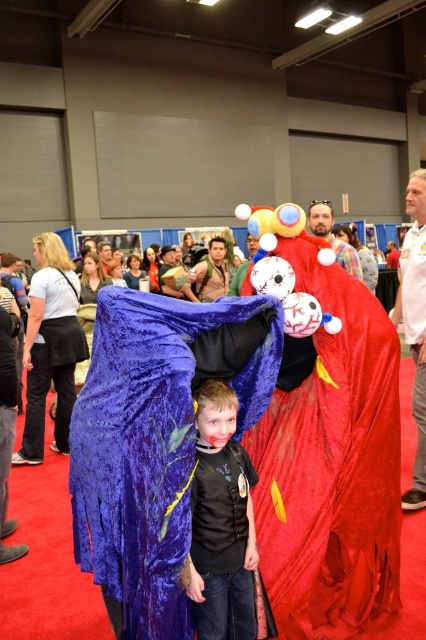
Question: Which point appears farthest from the camera in this image?

Choices:
 (A) (299, 416)
 (B) (416, 208)

Answer: (B)

Question: Does black matte vest at center appear on the right side of velvet red cape at center?

Choices:
 (A) no
 (B) yes

Answer: (A)

Question: Which of the following is the closest to the observer?

Choices:
 (A) black matte vest at center
 (B) velvet blue cape at center

Answer: (A)

Question: Which of the following is the closest to the observer?

Choices:
 (A) (420, 353)
 (B) (345, 248)
 (C) (155, 548)

Answer: (C)

Question: Is smooth white shirt at right closer to the viewer compared to velvet red cape at center?

Choices:
 (A) yes
 (B) no

Answer: (B)

Question: Can you confirm if velvet blue cape at center is positioned above velvet red cape at center?

Choices:
 (A) yes
 (B) no

Answer: (B)